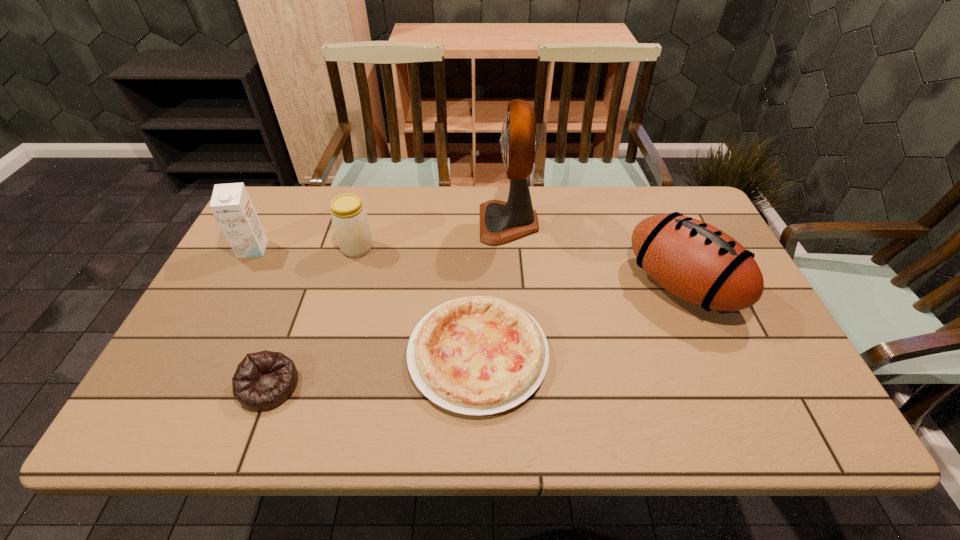
At what (x,y) coordinates should I click in order to perform the action: click on free point between the beanbag and the leftmost object. Please return your answer as a coordinate pair (x, y). This screenshot has width=960, height=540. Looking at the image, I should click on (261, 318).

Locate an element on the screen. The height and width of the screenshot is (540, 960). free space that is in between the carton and the fan is located at coordinates (381, 236).

Choose which object is the fifth nearest neighbor to the beanbag. Please provide its 2D coordinates. Your answer should be formatted as a tuple, i.e. [(x, y)], where the tuple contains the x and y coordinates of a point satisfying the conditions above.

[(695, 261)]

Find the location of a particular element. object that stands as the fifth closest to the tallest object is located at coordinates (231, 205).

The height and width of the screenshot is (540, 960). In order to click on blank area in the image that satisfies the following two spatial constraints: 1. on the front side of the jar; 2. on the right side of the pizza in this screenshot , I will do `click(327, 354)`.

Where is `free location that satisfies the following two spatial constraints: 1. on the back side of the beanbag; 2. on the left side of the jar`? free location that satisfies the following two spatial constraints: 1. on the back side of the beanbag; 2. on the left side of the jar is located at coordinates (321, 248).